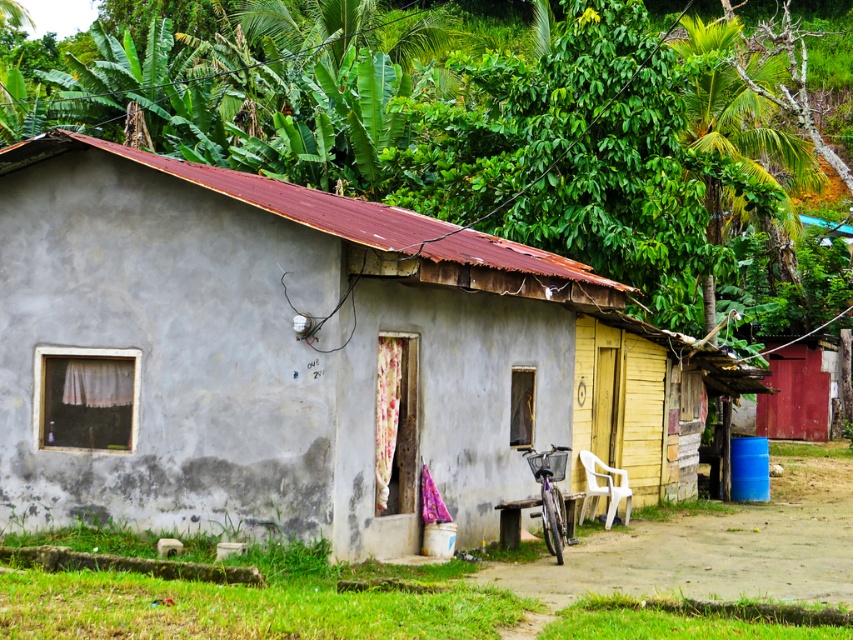
Question: Does gray concrete hut at center appear under green leafy vegetation at upper center?

Choices:
 (A) no
 (B) yes

Answer: (B)

Question: Which object is farther from the camera taking this photo?

Choices:
 (A) gray concrete hut at center
 (B) green leafy vegetation at upper center

Answer: (B)

Question: From the image, what is the correct spatial relationship of gray concrete hut at center in relation to green leafy vegetation at upper center?

Choices:
 (A) right
 (B) left

Answer: (A)

Question: Among these points, which one is farthest from the camera?

Choices:
 (A) (67, 468)
 (B) (730, 36)

Answer: (B)

Question: Does gray concrete hut at center appear over green leafy vegetation at upper center?

Choices:
 (A) no
 (B) yes

Answer: (A)